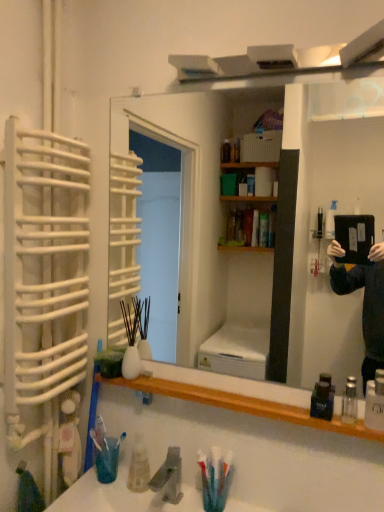
Question: Would you say gray matte faucet at lower center is to the left or to the right of dark blue plastic mouthwash at lower right, the 2th mouthwash in the right-to-left sequence, in the picture?

Choices:
 (A) right
 (B) left

Answer: (B)

Question: In terms of height, does gray matte faucet at lower center look taller or shorter compared to dark blue plastic mouthwash at lower right, the 2th mouthwash in the right-to-left sequence?

Choices:
 (A) short
 (B) tall

Answer: (B)

Question: Estimate the real-world distances between objects in this image. Which object is farther from the gray matte faucet at lower center?

Choices:
 (A) wooden shelf at lower center
 (B) clear glass bottle at lower right, positioned as the second mouthwash in left-to-right order
 (C) white plastic toothbrush at left, the first toothbrush positioned from the left
 (D) translucent plastic toothbrush at lower left, placed as the 2th toothbrush when sorted from left to right
 (E) wooden mirror at center

Answer: (E)

Question: Estimate the real-world distances between objects in this image. Which object is closer to the clear plastic bottles at lower right?

Choices:
 (A) white plastic toothbrush at left, positioned as the 2th toothbrush in right-to-left order
 (B) translucent plastic toothbrush at lower left, placed as the 2th toothbrush when sorted from left to right
 (C) clear plastic sink at lower center
 (D) wooden mirror at center
 (E) clear glass bottle at lower right, positioned as the second mouthwash in left-to-right order

Answer: (E)